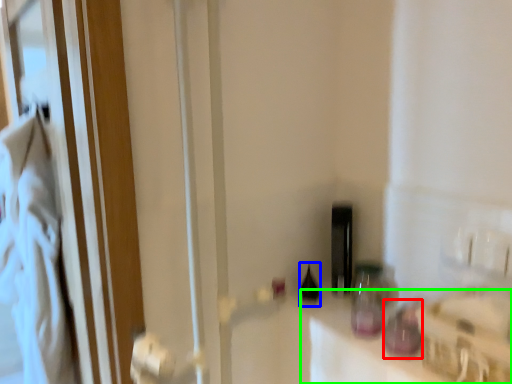
Question: Estimate the real-world distances between objects in this image. Which object is farther from bottle (highlighted by a red box), bottle (highlighted by a blue box) or counter top (highlighted by a green box)?

Choices:
 (A) bottle
 (B) counter top

Answer: (A)